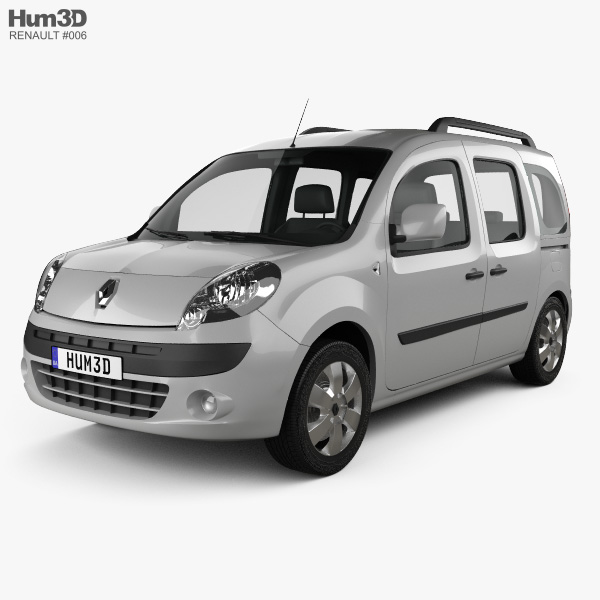
Identify the location of mirror. (422, 226).